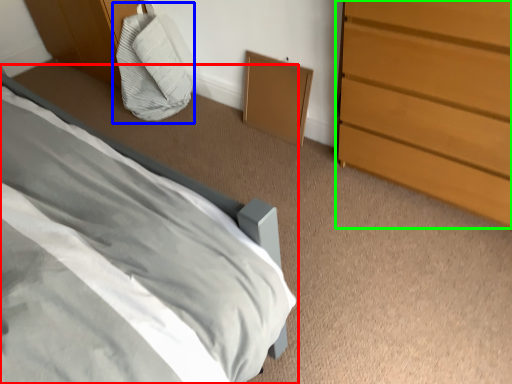
Question: Based on their relative distances, which object is nearer to bed (highlighted by a red box)? Choose from bean bag chair (highlighted by a blue box) and chest of drawers (highlighted by a green box).

Choices:
 (A) bean bag chair
 (B) chest of drawers

Answer: (B)